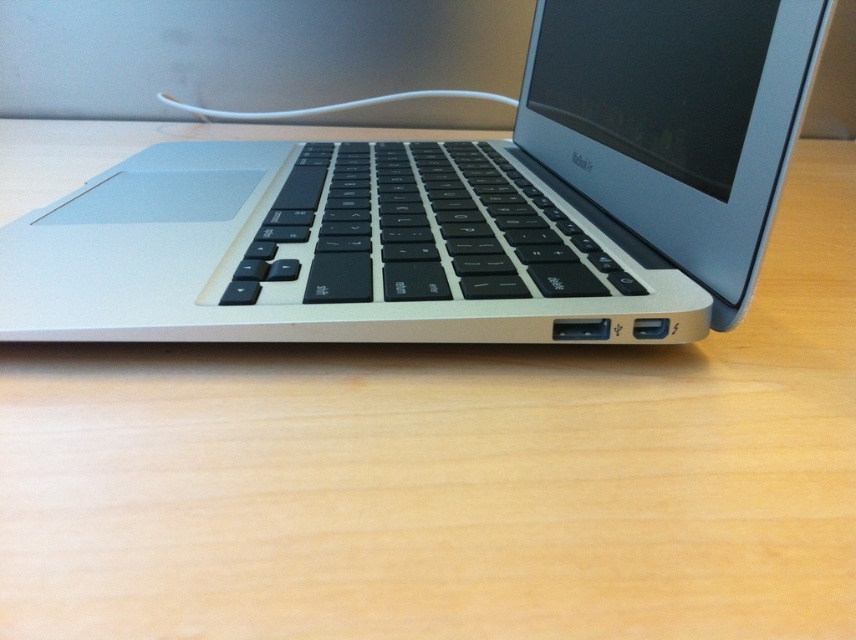
You are holding a small object that is 2 inches in diameter. You want to place it on the surface near the point labeled as point (403, 188). Considering the distance from the camera to that point, will the object fit entirely within the visible area of the laptop without overlapping the edges?

The distance between the camera and point (403, 188) is 25.69 inches. Since the object is only 2 inches in diameter, it will fit entirely within the visible area near point (403, 188) without overlapping the edges.

In the scene shown: You are taking a photo of the laptop and want to focus on both point [153,324] and point [550,227]. Which point should you focus on first to ensure both are in focus?

You should focus on point [153,324] first because it is closer to the camera than point [550,227], so focusing on the closer point will help ensure the farther point is also in focus.

You are setting up a workspace and need to place a mouse next to the silver metallic laptop at center and the black matte keyboard at center. Based on their positions, where should you place the mouse relative to the keyboard?

The silver metallic laptop at center is to the left of the black matte keyboard at center. Therefore, you should place the mouse to the right of the black matte keyboard at center, as that area is likely free from obstructions.